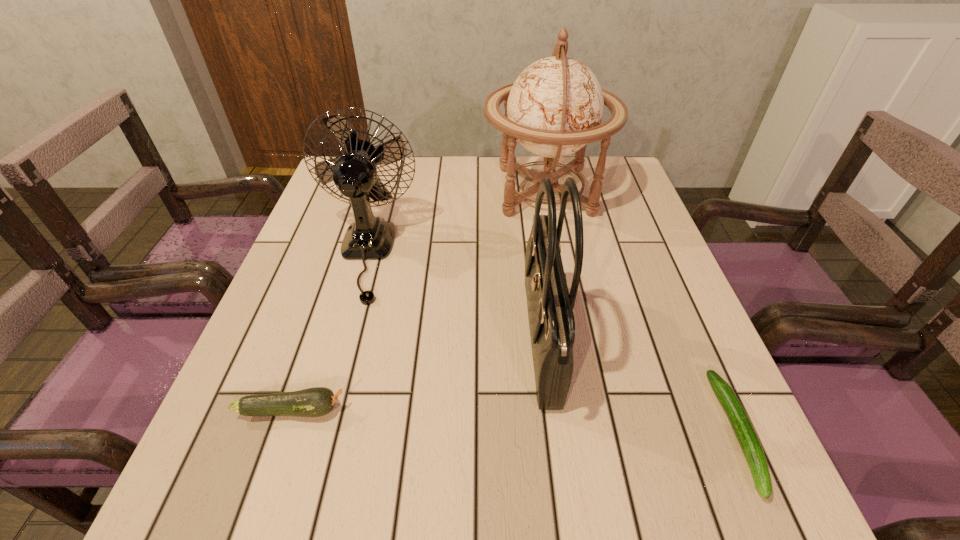
At what (x,y) coordinates should I click in order to perform the action: click on vacant area that lies between the handbag and the left zucchini. Please return your answer as a coordinate pair (x, y). Looking at the image, I should click on (417, 376).

The width and height of the screenshot is (960, 540). Identify the location of vacant space in between the rightmost object and the handbag. (639, 387).

Where is `blank region between the left zucchini and the fan`? Image resolution: width=960 pixels, height=540 pixels. blank region between the left zucchini and the fan is located at coordinates (329, 332).

Locate an element on the screen. vacant area that lies between the fan and the tallest object is located at coordinates (455, 222).

In order to click on vacant space in between the fan and the handbag in this screenshot , I will do `click(453, 298)`.

You are a GUI agent. You are given a task and a screenshot of the screen. Output one action in this format:
    pyautogui.click(x=<x>, y=<y>)
    Task: Click on the vacant point located between the fan and the handbag
    
    Given the screenshot: What is the action you would take?
    pyautogui.click(x=453, y=298)

The height and width of the screenshot is (540, 960). Identify the location of free spot between the shorter zucchini and the handbag. (639, 387).

Where is `object that is the fourth closest to the rightmost object`? The width and height of the screenshot is (960, 540). object that is the fourth closest to the rightmost object is located at coordinates (318, 401).

At what (x,y) coordinates should I click in order to perform the action: click on the fourth closest object to the rightmost object. Please return your answer as a coordinate pair (x, y). Image resolution: width=960 pixels, height=540 pixels. Looking at the image, I should click on (318, 401).

Where is `vacant region that satisfies the following two spatial constraints: 1. in front of the fan, indicating the direction of air flow; 2. at the blossom end of the second shortest object`? vacant region that satisfies the following two spatial constraints: 1. in front of the fan, indicating the direction of air flow; 2. at the blossom end of the second shortest object is located at coordinates (322, 410).